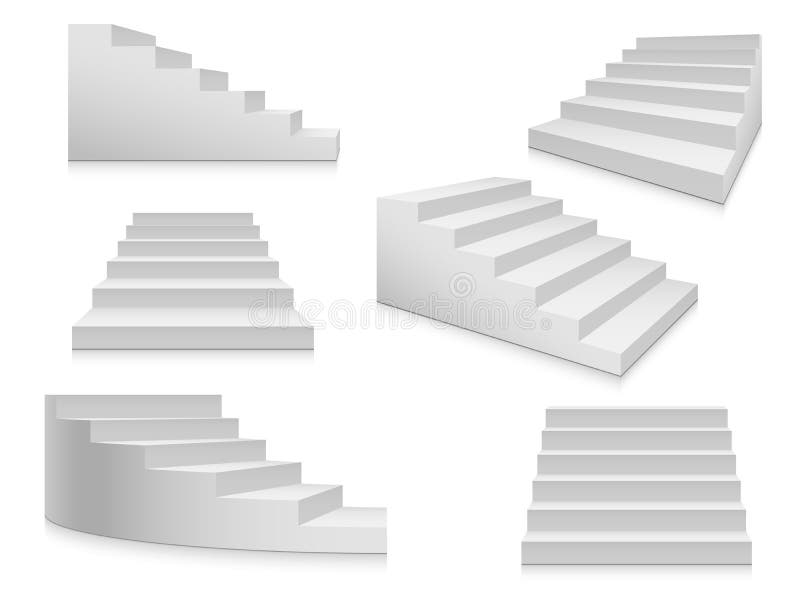
The image size is (800, 600). I want to click on staircases, so click(x=190, y=122), click(x=638, y=126), click(x=516, y=237), click(x=226, y=282), click(x=206, y=433), click(x=601, y=509).